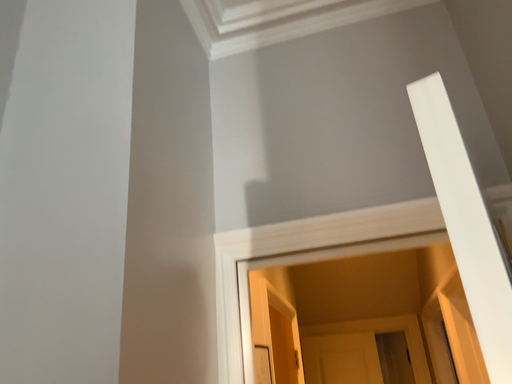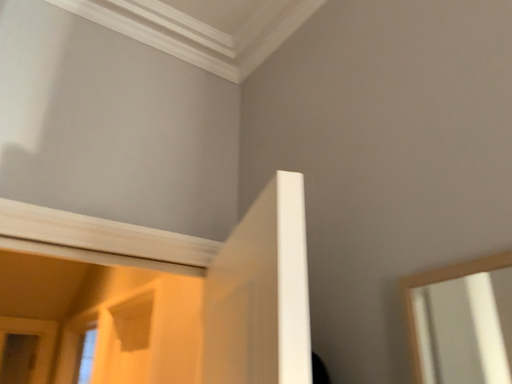
Question: Which way did the camera rotate in the video?

Choices:
 (A) rotated right
 (B) rotated left

Answer: (A)